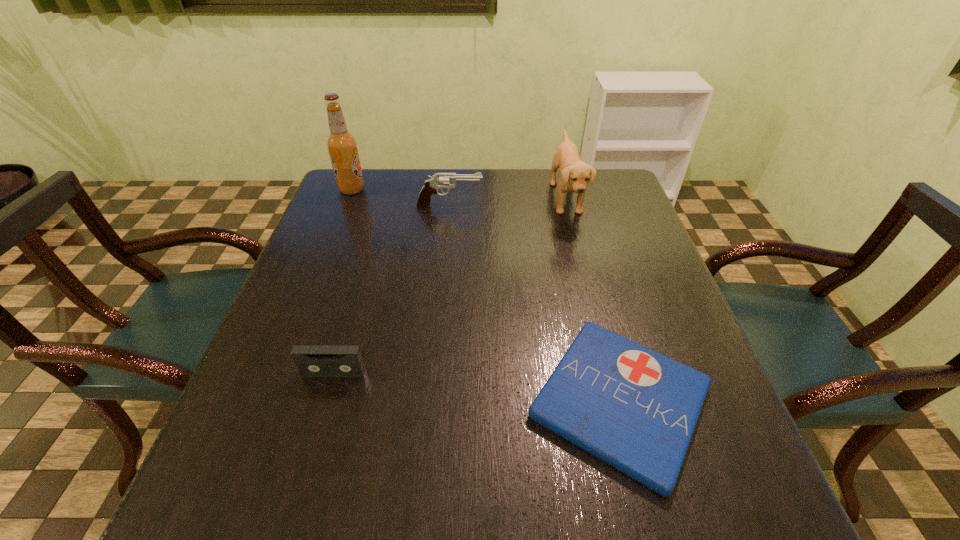
Where is `free point between the shortest object and the tallest object`? This screenshot has height=540, width=960. free point between the shortest object and the tallest object is located at coordinates (486, 295).

Identify the location of the second closest object to the leftmost object. The width and height of the screenshot is (960, 540). (574, 174).

I want to click on the third closest object relative to the gun, so click(636, 409).

Identify the location of vacant point that satisfies the following two spatial constraints: 1. on the back side of the first-aid kit; 2. at the muzzle of the third tallest object. (569, 206).

What are the coordinates of `vacant point that satisfies the following two spatial constraints: 1. on the back side of the first-aid kit; 2. on the left side of the second tallest object` in the screenshot? It's located at (567, 198).

Find the location of a particular element. The width and height of the screenshot is (960, 540). vacant area in the image that satisfies the following two spatial constraints: 1. at the muzzle of the third object from right to left; 2. on the left side of the first-aid kit is located at coordinates (432, 401).

I want to click on vacant region that satisfies the following two spatial constraints: 1. on the front label of the tallest object; 2. on the left side of the first-aid kit, so click(x=269, y=401).

Locate an element on the screen. This screenshot has width=960, height=540. free space that satisfies the following two spatial constraints: 1. on the front label of the first-aid kit; 2. on the left side of the tallest object is located at coordinates (269, 401).

This screenshot has height=540, width=960. I want to click on vacant space that satisfies the following two spatial constraints: 1. on the front-facing side of the videotape; 2. on the right side of the first-aid kit, so click(325, 401).

Find the location of a particular element. The width and height of the screenshot is (960, 540). blank area in the image that satisfies the following two spatial constraints: 1. at the muzzle of the third object from right to left; 2. on the right side of the first-aid kit is located at coordinates (432, 401).